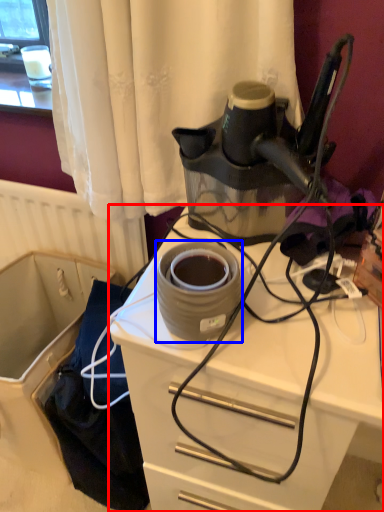
Question: Which object appears closest to the camera in this image, desk (highlighted by a red box) or appliance (highlighted by a blue box)?

Choices:
 (A) desk
 (B) appliance

Answer: (A)